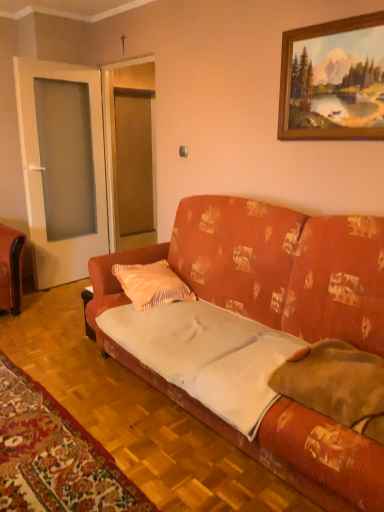
Question: Would you say white fabric mat at lower left contains textured orange couch at center?

Choices:
 (A) yes
 (B) no

Answer: (B)

Question: From the image's perspective, is white fabric mat at lower left located beneath textured orange couch at center?

Choices:
 (A) yes
 (B) no

Answer: (A)

Question: Can you confirm if white fabric mat at lower left is positioned to the left of textured orange couch at center?

Choices:
 (A) yes
 (B) no

Answer: (A)

Question: From a real-world perspective, is white fabric mat at lower left beneath textured orange couch at center?

Choices:
 (A) yes
 (B) no

Answer: (A)

Question: Considering the relative positions of white fabric mat at lower left and textured orange couch at center in the image provided, is white fabric mat at lower left to the right of textured orange couch at center from the viewer's perspective?

Choices:
 (A) yes
 (B) no

Answer: (B)

Question: Is the depth of white fabric mat at lower left less than that of textured orange couch at center?

Choices:
 (A) yes
 (B) no

Answer: (B)

Question: Can you confirm if transparent glass door at left is bigger than white cotton sheet at center?

Choices:
 (A) yes
 (B) no

Answer: (A)

Question: Does transparent glass door at left touch white cotton sheet at center?

Choices:
 (A) no
 (B) yes

Answer: (A)

Question: From a real-world perspective, is transparent glass door at left located beneath white cotton sheet at center?

Choices:
 (A) no
 (B) yes

Answer: (A)

Question: Is transparent glass door at left looking in the opposite direction of white cotton sheet at center?

Choices:
 (A) yes
 (B) no

Answer: (B)

Question: Is transparent glass door at left aimed at white cotton sheet at center?

Choices:
 (A) no
 (B) yes

Answer: (B)

Question: Is white cotton sheet at center inside transparent glass door at left?

Choices:
 (A) no
 (B) yes

Answer: (A)

Question: From a real-world perspective, is orange velvet pillow at center, the 2th pillow in the right-to-left sequence, under textured orange couch at center?

Choices:
 (A) yes
 (B) no

Answer: (A)